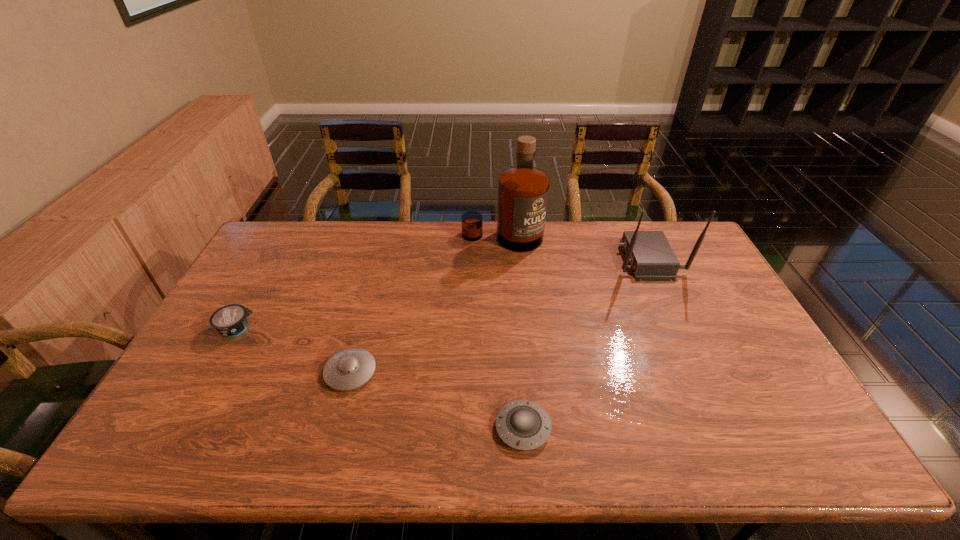
Where is `vacant position located 0.280m on the back of the fourth shortest object to connect cables`? The width and height of the screenshot is (960, 540). vacant position located 0.280m on the back of the fourth shortest object to connect cables is located at coordinates (534, 259).

You are a GUI agent. You are given a task and a screenshot of the screen. Output one action in this format:
    pyautogui.click(x=<x>, y=<y>)
    Task: Click on the free space located on the back of the fourth shortest object to connect cables
    This screenshot has width=960, height=540.
    Given the screenshot: What is the action you would take?
    pyautogui.click(x=516, y=259)

Where is `free space located 0.390m on the back of the fourth shortest object to connect cables`? free space located 0.390m on the back of the fourth shortest object to connect cables is located at coordinates (502, 259).

At what (x,y) coordinates should I click in order to perform the action: click on vacant space located 0.110m on the right of the third tallest object. Please return your answer as a coordinate pair (x, y). The width and height of the screenshot is (960, 540). Looking at the image, I should click on [295, 329].

Identify the location of free space located on the left of the farther saucer. The image size is (960, 540). (212, 372).

This screenshot has height=540, width=960. In order to click on free space located 0.250m on the back of the shortest object in this screenshot , I will do `click(516, 329)`.

Locate an element on the screen. The image size is (960, 540). liquor present at the far edge is located at coordinates coord(523,189).

You are a GUI agent. You are given a task and a screenshot of the screen. Output one action in this format:
    pyautogui.click(x=<x>, y=<y>)
    Task: Click on the router that is at the far edge
    The image size is (960, 540).
    Given the screenshot: What is the action you would take?
    pyautogui.click(x=649, y=253)

At what (x,y) coordinates should I click in order to perform the action: click on object that is at the near edge. Please return your answer as a coordinate pair (x, y). The image size is (960, 540). Looking at the image, I should click on (524, 425).

I want to click on object at the left edge, so click(x=231, y=320).